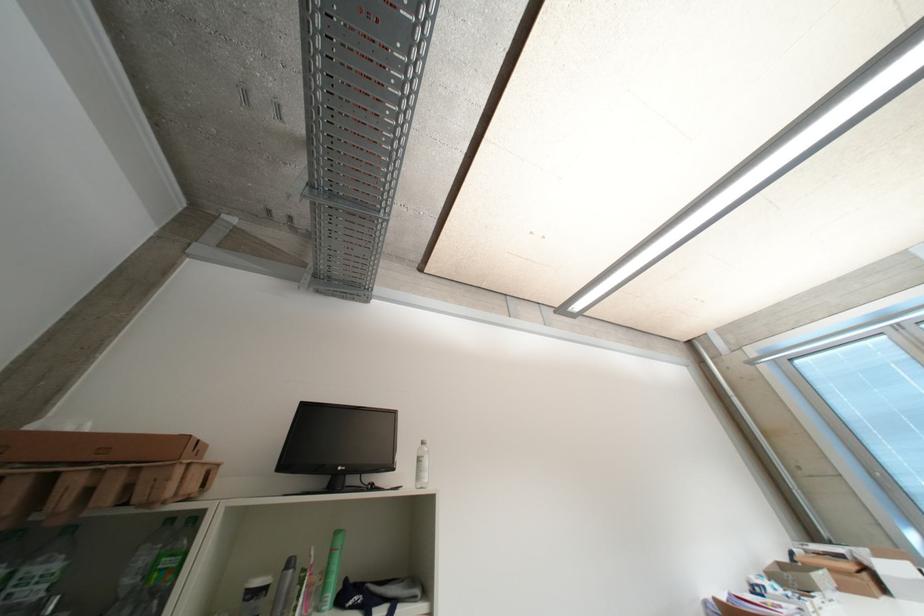
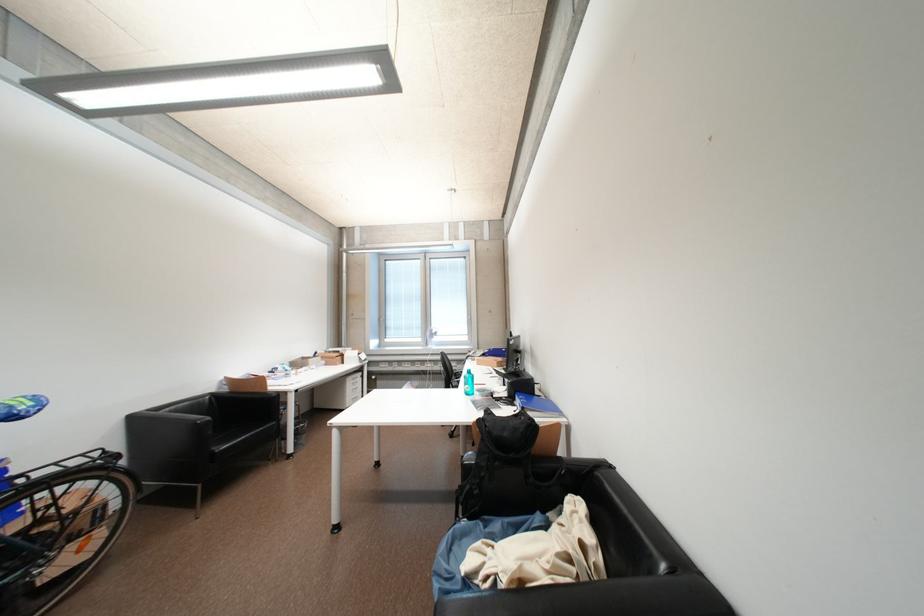
Where in the second image is the point corresponding to point 856,576 from the first image?

(341, 360)